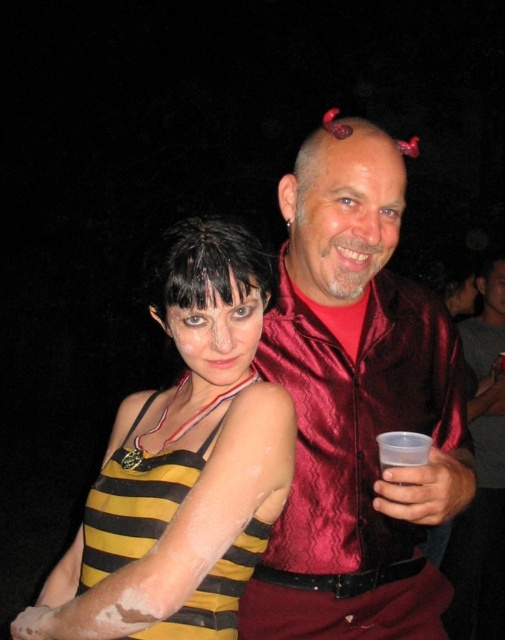
What is located at the coordinates point (481, 476)?

The shiny red shirt at center is located at point (481, 476).

You are a photographer at a party. You see the shiny red shirt at center and the dark shiny hair at center in your camera frame. Which object is positioned higher in the image?

The shiny red shirt at center is much taller than dark shiny hair at center, so it is positioned higher in the image.